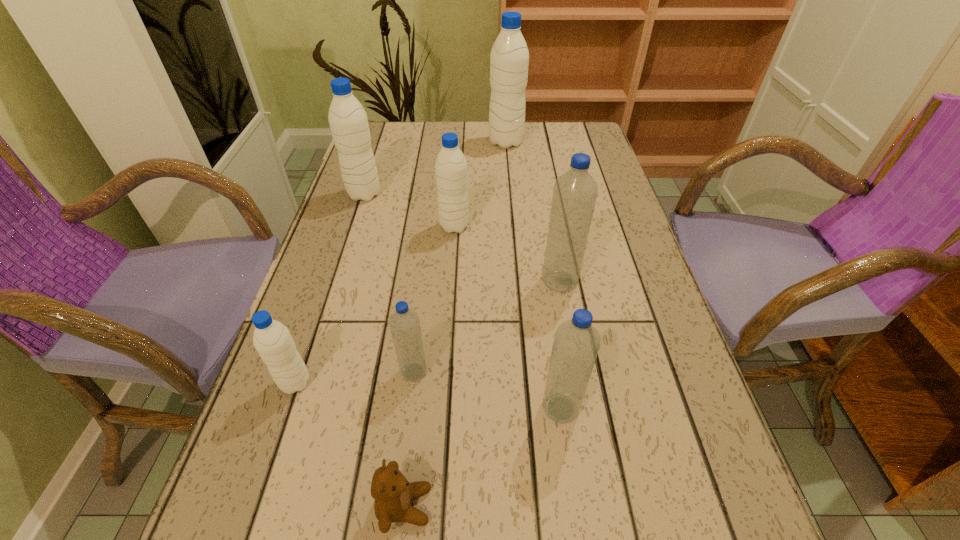
Identify the location of object that is at the right edge. Image resolution: width=960 pixels, height=540 pixels. (575, 192).

In the image, there is a desktop. Where is `vacant region at the left edge`? The width and height of the screenshot is (960, 540). vacant region at the left edge is located at coordinates (390, 234).

Identify the location of free space at the right edge of the desktop. This screenshot has width=960, height=540. (587, 248).

Locate an element on the screen. blank area at the far left corner is located at coordinates (386, 143).

Where is `free space at the far right corner`? The width and height of the screenshot is (960, 540). free space at the far right corner is located at coordinates (556, 126).

What are the coordinates of `unoccupied area between the tallest water bottle and the second biggest blue water bottle` in the screenshot? It's located at (533, 275).

The height and width of the screenshot is (540, 960). I want to click on free spot between the second farthest water bottle and the nearest blue water bottle, so click(x=463, y=301).

Identify the location of free space between the smallest gray water bottle and the third smallest gray water bottle. (329, 288).

Locate an element on the screen. free space between the rightmost gray water bottle and the nearest blue water bottle is located at coordinates (533, 275).

Image resolution: width=960 pixels, height=540 pixels. Identify the location of empty space that is in between the nearest blue water bottle and the smallest gray water bottle. (428, 395).